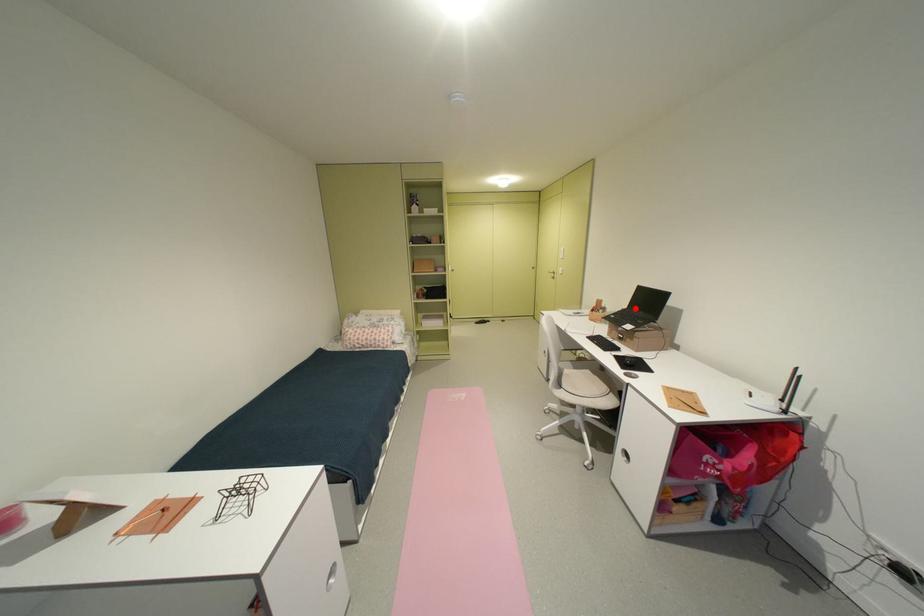
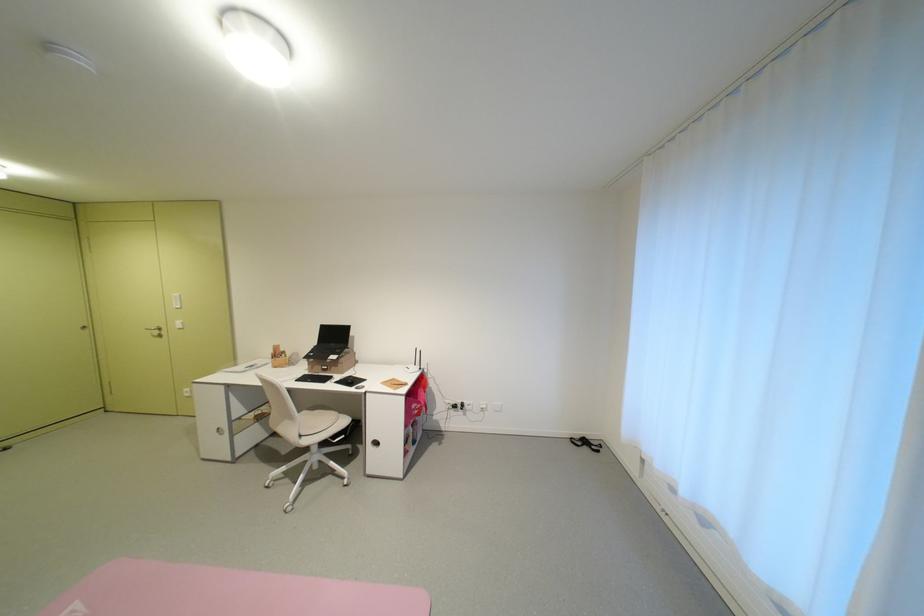
Question: I am providing you with two images of the same scene from different viewpoints. A red point is marked on the first image. Is the red point's position out of view in image 2?

Choices:
 (A) Yes
 (B) No

Answer: (B)